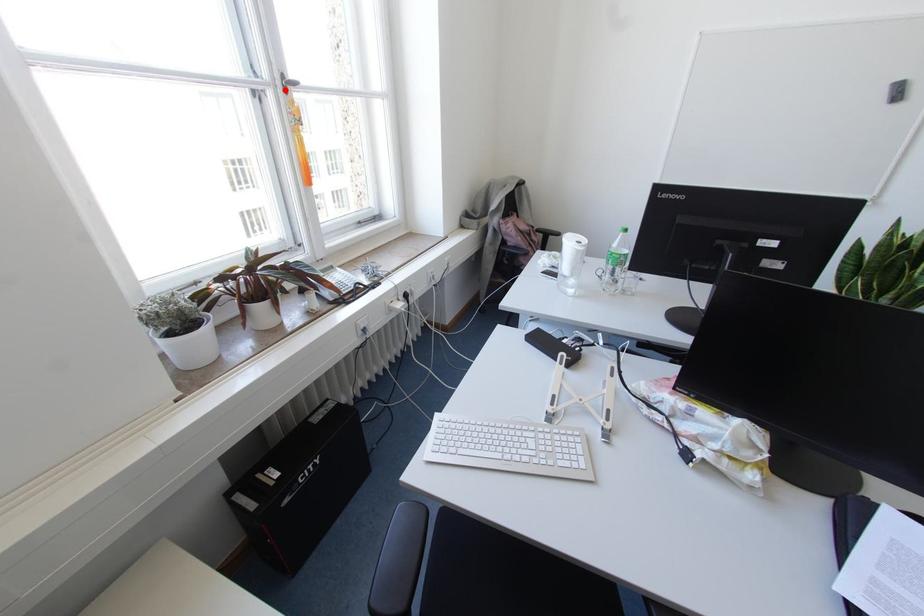
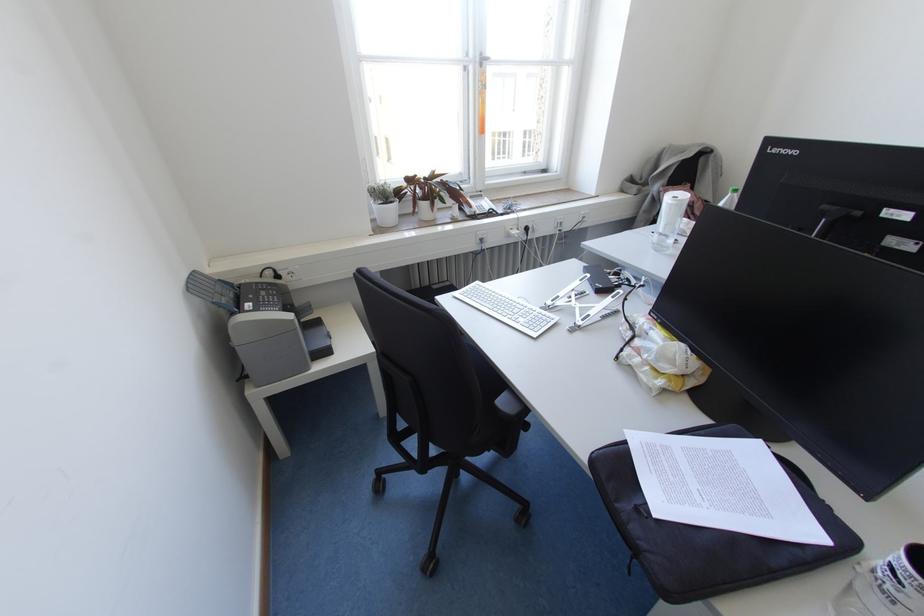
Find the pixel in the second image that matches the highlighted location in the first image.

(480, 65)